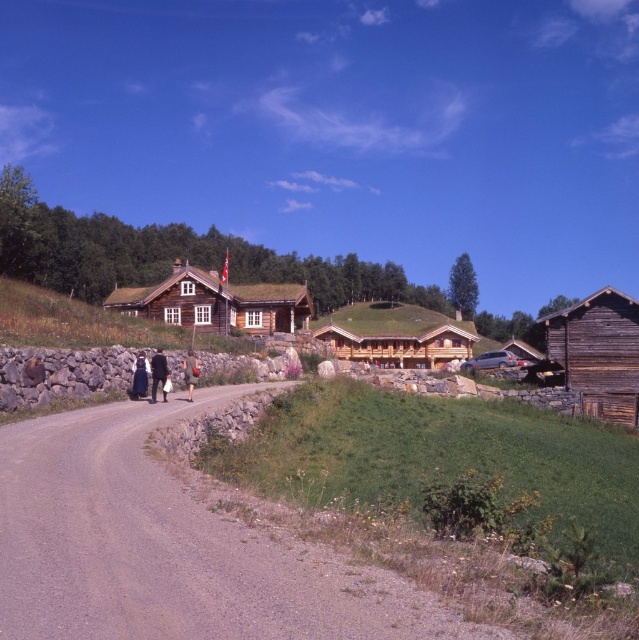
You are standing at the camera position looking at the rural scene. There are two points marked in the image, one at coordinate point (631, 304) and another at point (355, 349). Which point is closer to you?

Point (631, 304) is closer to the camera than point (355, 349).

You are a traveler standing on the dirt road and see the wooden barn at right and the black fabric dress at center. Which object is larger in size?

The wooden barn at right is bigger than the black fabric dress at center.